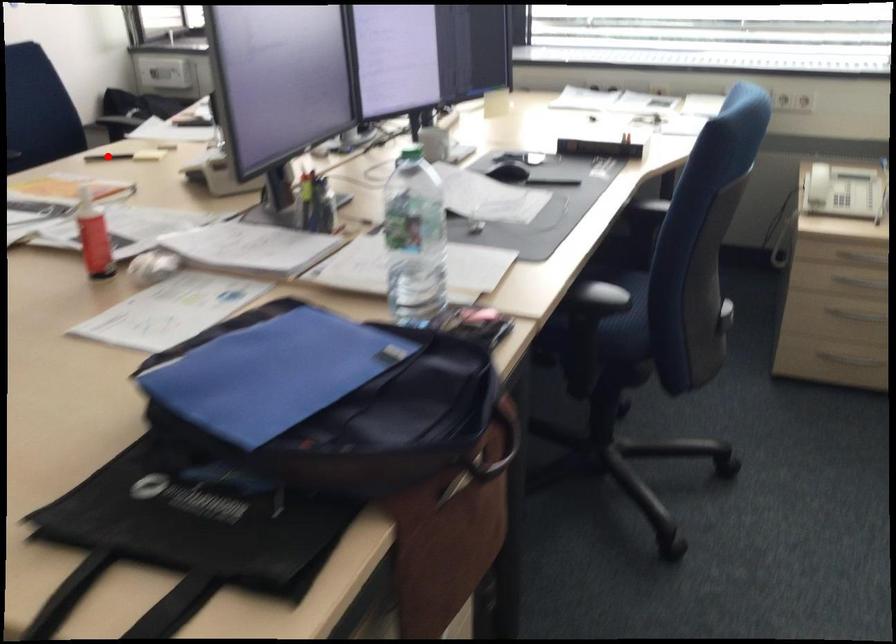
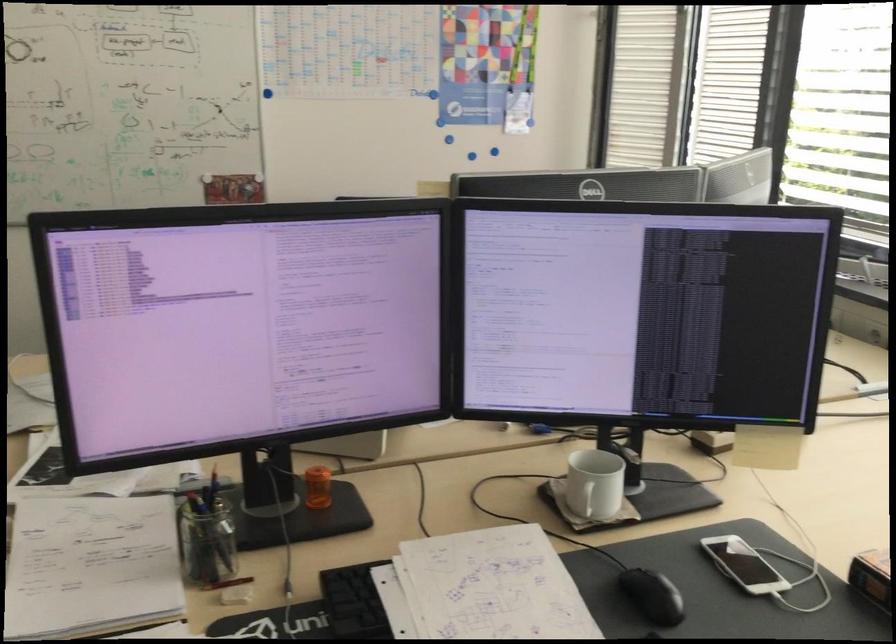
Question: I am providing you with two images of the same scene from different viewpoints. A red point is marked on the first image. At the location where the point appears in image 1, is it still visible in image 2?

Choices:
 (A) Yes
 (B) No

Answer: (B)